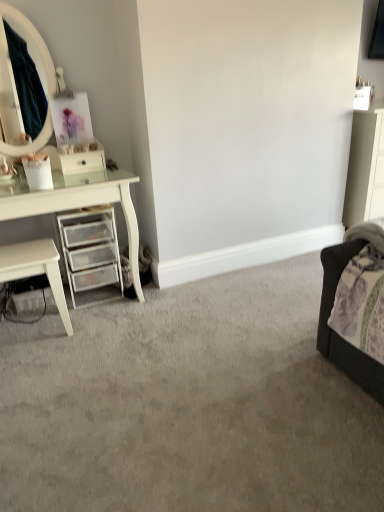
Question: Visually, is clear plastic drawers at left positioned to the left or to the right of white glossy nightstand at left?

Choices:
 (A) left
 (B) right

Answer: (B)

Question: Considering the positions of clear plastic drawers at left and white glossy nightstand at left in the image, is clear plastic drawers at left bigger or smaller than white glossy nightstand at left?

Choices:
 (A) small
 (B) big

Answer: (B)

Question: Based on their relative distances, which object is farther from the clear plastic drawers at left?

Choices:
 (A) white glossy drawer at left
 (B) white glossy nightstand at left

Answer: (A)

Question: Which object is positioned closest to the white glossy drawer at left?

Choices:
 (A) white glossy nightstand at left
 (B) clear plastic drawers at left

Answer: (B)